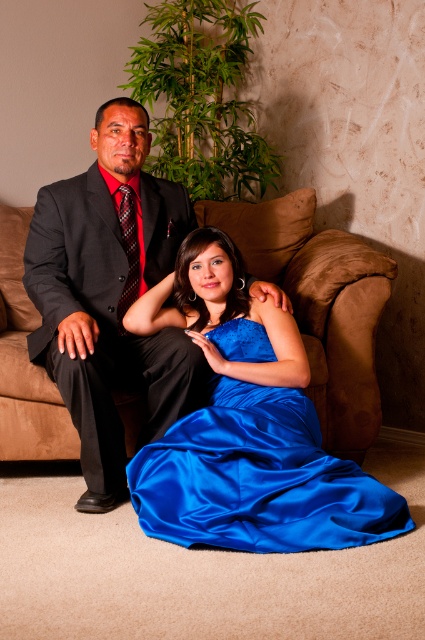
What do you see at coordinates (257, 477) in the screenshot? The image size is (425, 640). I see `satin blue dress at center` at bounding box center [257, 477].

Between satin blue dress at center and black satin suit at left, which one is positioned lower?

Positioned lower is satin blue dress at center.

Does point (136, 472) come closer to viewer compared to point (108, 296)?

Yes, it is in front of point (108, 296).

Find the location of a particular element. The height and width of the screenshot is (640, 425). satin blue dress at center is located at coordinates click(x=257, y=477).

Who is shorter, satin blue dress at center or brown fabric couch at center?

satin blue dress at center

Does satin blue dress at center appear on the left side of brown fabric couch at center?

Indeed, satin blue dress at center is positioned on the left side of brown fabric couch at center.

Which is behind, point (269, 403) or point (306, 301)?

Point (306, 301)

Identify the location of satin blue dress at center. The height and width of the screenshot is (640, 425). (257, 477).

Between point (33, 408) and point (159, 401), which one is positioned in front?

Point (159, 401) is in front.

Is brown fabric couch at center shorter than black satin suit at left?

No, brown fabric couch at center is not shorter than black satin suit at left.

Between point (16, 310) and point (146, 220), which one is positioned in front?

Point (146, 220) is in front.

The width and height of the screenshot is (425, 640). In order to click on brown fabric couch at center in this screenshot , I will do `click(320, 305)`.